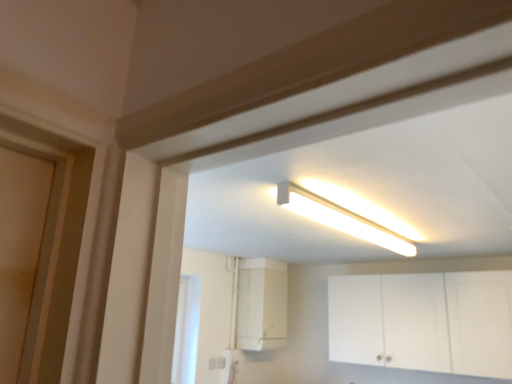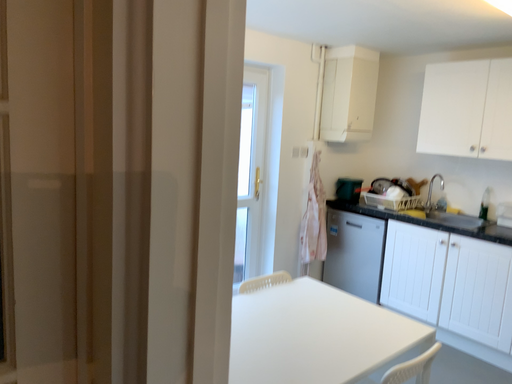
Question: Which way did the camera rotate in the video?

Choices:
 (A) rotated downward
 (B) rotated upward

Answer: (A)